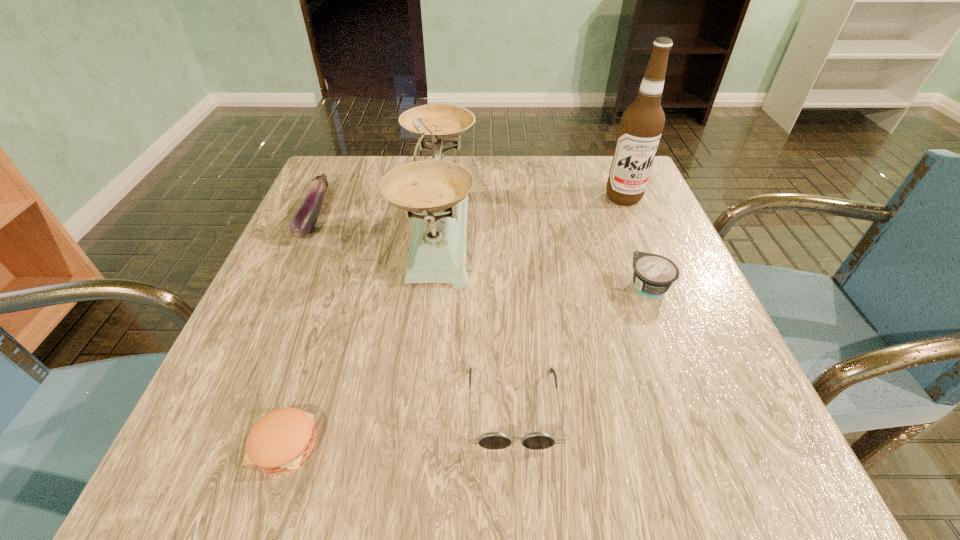
Locate an element on the screen. free location located 0.050m on the front-facing side of the sunglasses is located at coordinates (518, 490).

Where is `vacant region located 0.090m on the back of the patty`? vacant region located 0.090m on the back of the patty is located at coordinates (312, 363).

Locate an element on the screen. The image size is (960, 540). alcohol located in the far edge section of the desktop is located at coordinates (642, 123).

The width and height of the screenshot is (960, 540). Identify the location of scale located in the far edge section of the desktop. click(x=436, y=191).

Image resolution: width=960 pixels, height=540 pixels. I want to click on eggplant that is at the far edge, so click(304, 220).

Find the location of a particular element. The width and height of the screenshot is (960, 540). sunglasses present at the near edge is located at coordinates (492, 440).

Find the location of a particular element. patty that is at the near edge is located at coordinates (281, 440).

Image resolution: width=960 pixels, height=540 pixels. Find the location of `eggplant at the left edge`. eggplant at the left edge is located at coordinates (304, 220).

Where is `patty at the left edge`? This screenshot has width=960, height=540. patty at the left edge is located at coordinates (281, 440).

Where is `alcohol at the right edge`? The height and width of the screenshot is (540, 960). alcohol at the right edge is located at coordinates (642, 123).